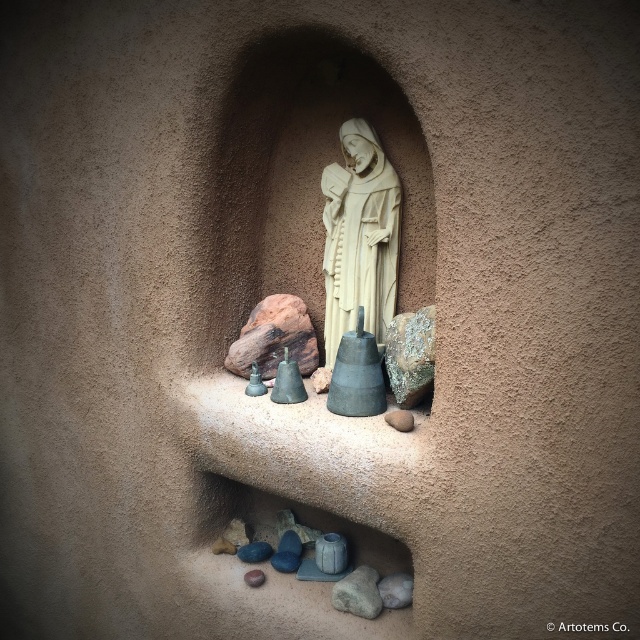
Question: Does gray rough stone at center appear on the right side of smooth gray rock at center?

Choices:
 (A) yes
 (B) no

Answer: (B)

Question: Among these points, which one is farthest from the camera?

Choices:
 (A) (406, 412)
 (B) (372, 196)
 (C) (365, 566)

Answer: (C)

Question: Is white stone statue at center wider than smooth gray rock at center?

Choices:
 (A) no
 (B) yes

Answer: (B)

Question: Which point is closer to the camera?

Choices:
 (A) (412, 419)
 (B) (336, 333)
 (C) (369, 612)

Answer: (A)

Question: Among these points, which one is farthest from the camera?

Choices:
 (A) (403, 422)
 (B) (336, 609)
 (C) (333, 220)

Answer: (C)

Question: Does white stone statue at center have a greater width compared to smooth gray rock at center?

Choices:
 (A) yes
 (B) no

Answer: (A)